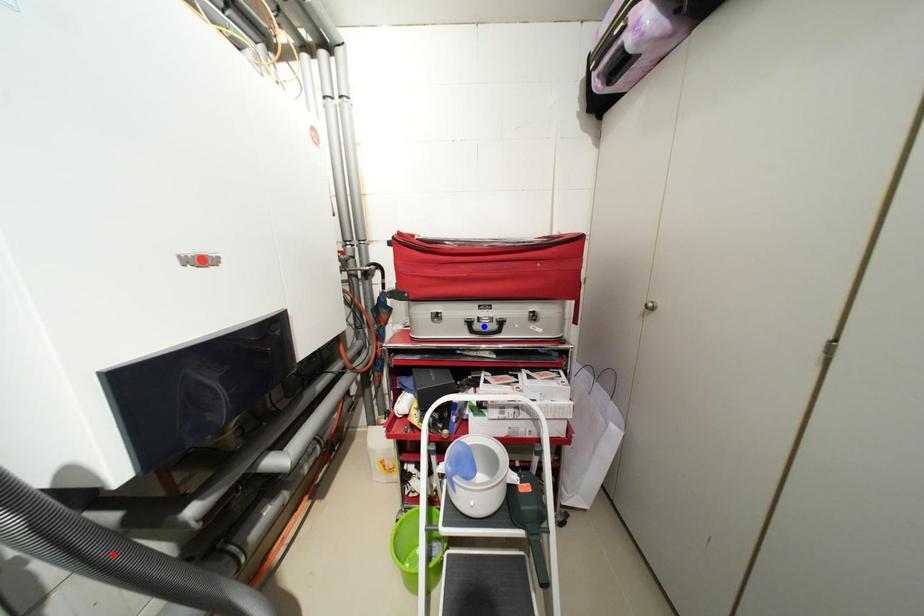
Question: Two points are marked on the image. Which point is closer to the camera?

Choices:
 (A) Blue point is closer.
 (B) Red point is closer.

Answer: (B)